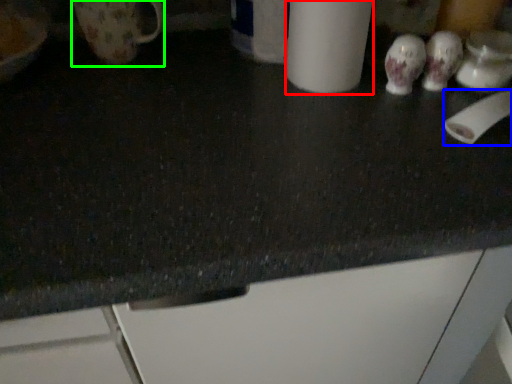
Question: Which is farther away from paper towel (highlighted by a red box)? toilet paper (highlighted by a blue box) or mug (highlighted by a green box)?

Choices:
 (A) toilet paper
 (B) mug

Answer: (B)